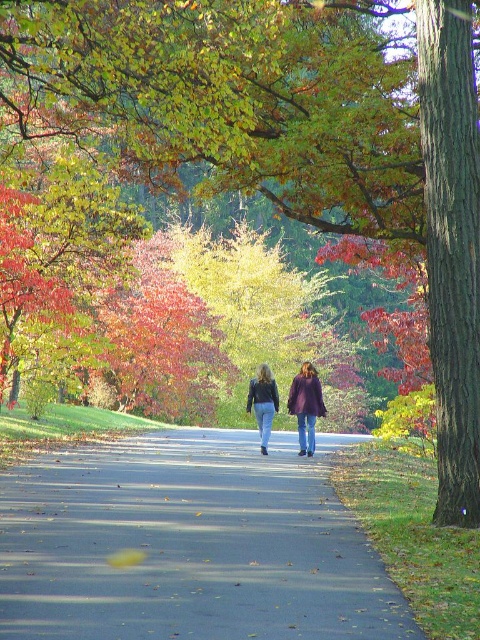
Question: Which is farther from the smooth bark tree at right?

Choices:
 (A) asphalt road at center
 (B) matte purple coat at center
 (C) purple matte coat at center

Answer: (C)

Question: Estimate the real-world distances between objects in this image. Which object is closer to the smooth bark tree at right?

Choices:
 (A) matte purple coat at center
 (B) asphalt road at center

Answer: (B)

Question: Is asphalt road at center behind smooth bark tree at right?

Choices:
 (A) no
 (B) yes

Answer: (A)

Question: Is asphalt road at center further to the viewer compared to purple matte coat at center?

Choices:
 (A) no
 (B) yes

Answer: (A)

Question: Which point is closer to the camera?

Choices:
 (A) jeans at center
 (B) asphalt road at center

Answer: (B)

Question: Does smooth bark tree at right appear on the right side of jeans at center?

Choices:
 (A) yes
 (B) no

Answer: (A)